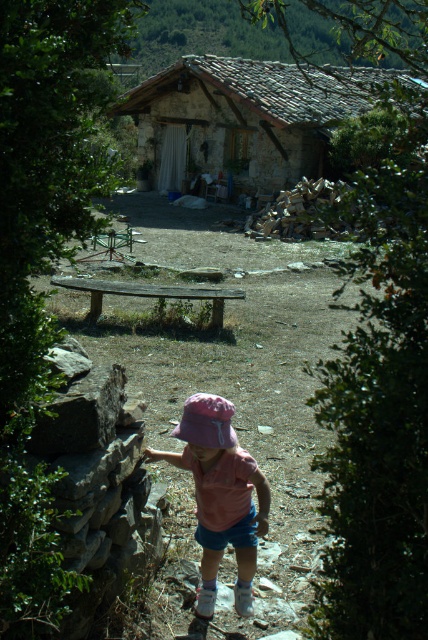
Is pink fabric hat at center positioned in front of purple fabric hat at lower center?

That is True.

From the picture: Between pink fabric hat at center and purple fabric hat at lower center, which one appears on the right side from the viewer's perspective?

purple fabric hat at lower center

Is point (228, 477) positioned behind point (196, 429)?

Yes, it is.

I want to click on pink fabric hat at center, so click(219, 496).

Is rustic stone hut at center below pink fabric hat at center?

Actually, rustic stone hut at center is above pink fabric hat at center.

Is rustic stone hut at center positioned at the back of pink fabric hat at center?

That is True.

Between point (142, 115) and point (196, 410), which one is positioned in front?

Point (196, 410) is more forward.

Where is `rustic stone hut at center`? The height and width of the screenshot is (640, 428). rustic stone hut at center is located at coordinates (243, 116).

Is point (136, 88) positioned in front of point (219, 419)?

No, (136, 88) is further to viewer.

Can you confirm if rustic stone hut at center is bigger than purple fabric hat at lower center?

Correct, rustic stone hut at center is larger in size than purple fabric hat at lower center.

Where is `rustic stone hut at center`? rustic stone hut at center is located at coordinates (243, 116).